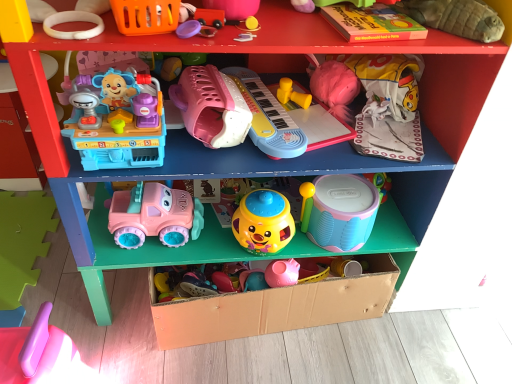
What are the coordinates of `free space in front of yellow plastic toy at upper center, marked as the 4th toy in a right-to-left arrangement` in the screenshot? It's located at (309, 122).